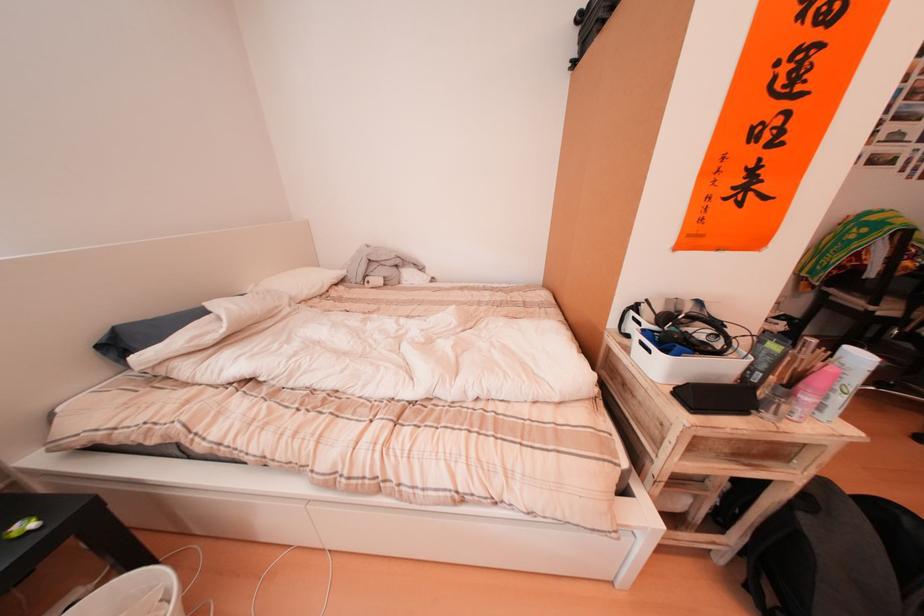
The height and width of the screenshot is (616, 924). Describe the element at coordinates (837, 556) in the screenshot. I see `the chair armrest` at that location.